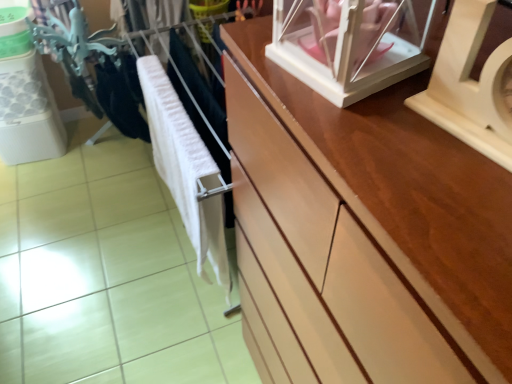
Question: Can you confirm if white soft cloth at center is positioned to the left of white glossy glass box at upper right?

Choices:
 (A) yes
 (B) no

Answer: (A)

Question: Is white soft cloth at center shorter than white glossy glass box at upper right?

Choices:
 (A) no
 (B) yes

Answer: (A)

Question: From the image's perspective, is white soft cloth at center located beneath white glossy glass box at upper right?

Choices:
 (A) no
 (B) yes

Answer: (B)

Question: Is white soft cloth at center at the right side of white glossy glass box at upper right?

Choices:
 (A) yes
 (B) no

Answer: (B)

Question: Is white soft cloth at center facing towards white glossy glass box at upper right?

Choices:
 (A) no
 (B) yes

Answer: (A)

Question: Is white soft cloth at center thinner than white glossy glass box at upper right?

Choices:
 (A) no
 (B) yes

Answer: (B)

Question: Is wooden clock at upper right further to camera compared to white glossy glass box at upper right?

Choices:
 (A) yes
 (B) no

Answer: (B)

Question: Does wooden clock at upper right have a lesser height compared to white glossy glass box at upper right?

Choices:
 (A) no
 (B) yes

Answer: (A)

Question: From a real-world perspective, is wooden clock at upper right on top of white glossy glass box at upper right?

Choices:
 (A) yes
 (B) no

Answer: (B)

Question: Can you confirm if wooden clock at upper right is smaller than white glossy glass box at upper right?

Choices:
 (A) no
 (B) yes

Answer: (B)

Question: Is wooden clock at upper right wider than white glossy glass box at upper right?

Choices:
 (A) no
 (B) yes

Answer: (A)

Question: From the image's perspective, is wooden clock at upper right located beneath white glossy glass box at upper right?

Choices:
 (A) no
 (B) yes

Answer: (B)

Question: Is white soft cloth at center positioned behind wooden clock at upper right?

Choices:
 (A) no
 (B) yes

Answer: (B)